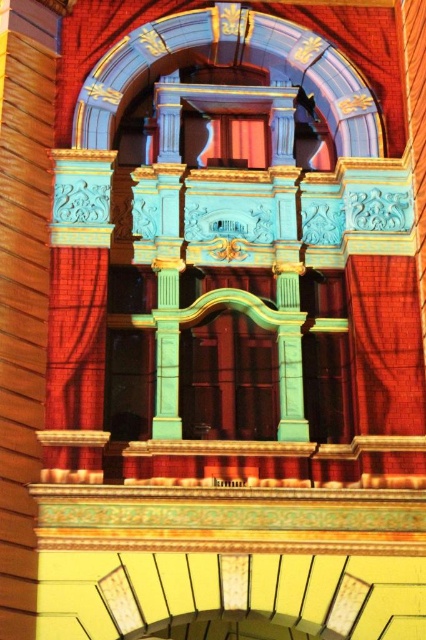
Question: Is smooth red brick column at center smaller than matte red curtain at center?

Choices:
 (A) no
 (B) yes

Answer: (A)

Question: Estimate the real-world distances between objects in this image. Which object is closer to the matte red curtain at center?

Choices:
 (A) smooth red brick column at center
 (B) velvet red curtain at left

Answer: (A)

Question: Is smooth red brick column at center smaller than matte red curtain at center?

Choices:
 (A) yes
 (B) no

Answer: (B)

Question: Can you confirm if velvet red curtain at left is positioned above matte red curtain at center?

Choices:
 (A) no
 (B) yes

Answer: (A)

Question: Estimate the real-world distances between objects in this image. Which object is farther from the matte red curtain at center?

Choices:
 (A) smooth red brick column at center
 (B) velvet red curtain at left

Answer: (B)

Question: Which point is farther from the camera taking this photo?

Choices:
 (A) (5, 74)
 (B) (78, 284)
 (C) (255, 145)

Answer: (C)